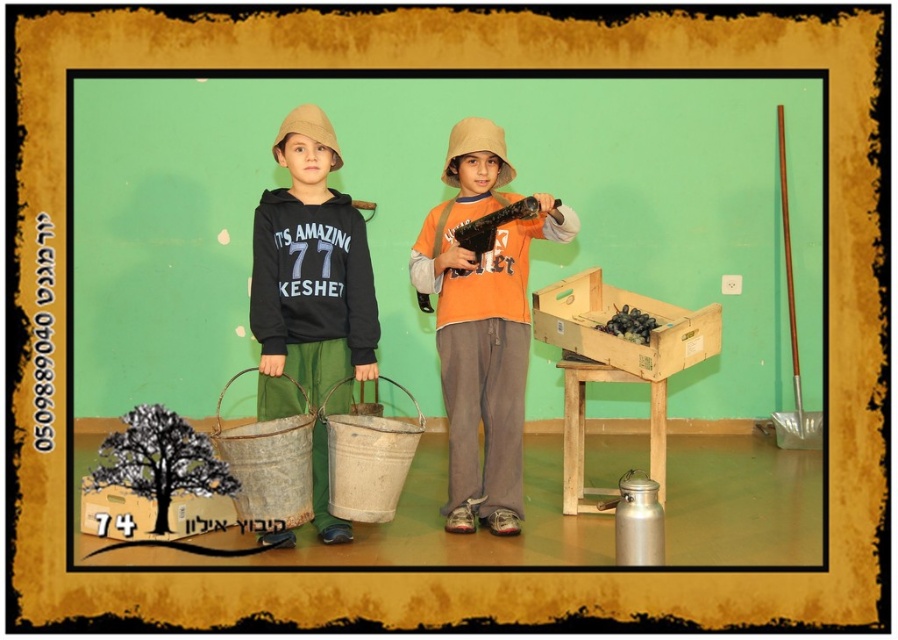
You are a delivery person who needs to place a package between the matte black hoodie at center and the wooden crate at center. The package requires 40 inches of space. Can you fit it between them?

The space between the matte black hoodie at center and the wooden crate at center is only 37.27 inches, which is less than the required 40 inches. Therefore, the package cannot fit between them.

You are a photographer setting up a photo shoot. You have to position a camera so that both the orange cotton shirt at center and the wooden crate at center are in frame. Which object should you ensure is closer to the camera to avoid it being cut off?

The orange cotton shirt at center is much taller than the wooden crate at center, so you should ensure the orange cotton shirt at center is closer to the camera to avoid it being cut off.

You are a photographer setting up for a group photo. You notice the orange cotton shirt at center and the matte black hoodie at center in the scene. Which clothing item is positioned lower on the children?

The orange cotton shirt at center is located below matte black hoodie at center, so the orange cotton shirt at center is positioned lower on the children.